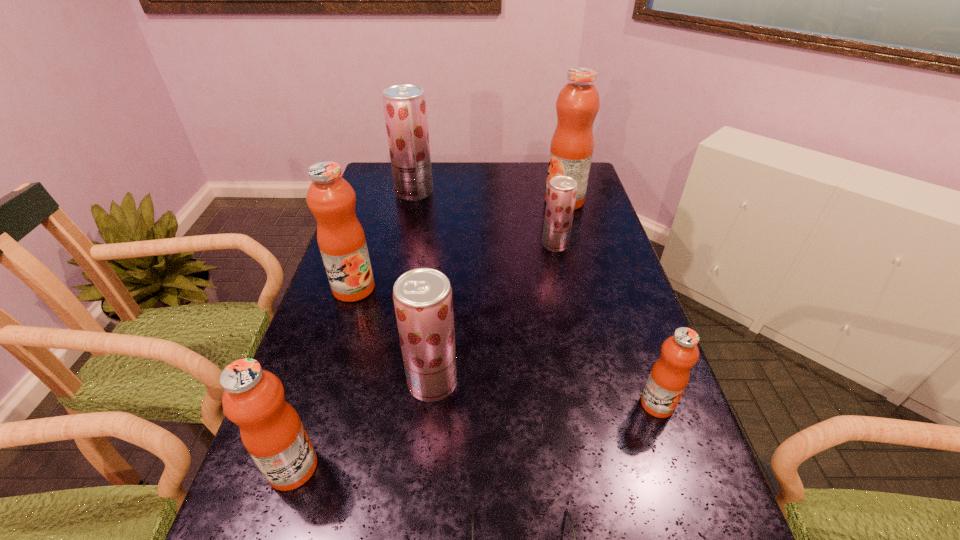
Where is `the sixth nearest object`? This screenshot has height=540, width=960. the sixth nearest object is located at coordinates (562, 190).

Find the location of a particular element. Image resolution: width=960 pixels, height=540 pixels. the fifth nearest fruit juice is located at coordinates (562, 190).

Where is `the smallest orange fruit juice`? The image size is (960, 540). the smallest orange fruit juice is located at coordinates (669, 376).

Where is `vacant region located 0.380m on the front label of the farthest orange fruit juice`? The height and width of the screenshot is (540, 960). vacant region located 0.380m on the front label of the farthest orange fruit juice is located at coordinates (441, 201).

Locate an element on the screen. This screenshot has width=960, height=540. free space located on the front label of the farthest orange fruit juice is located at coordinates click(445, 201).

Locate an element on the screen. The image size is (960, 540). vacant space located 0.380m on the front label of the farthest orange fruit juice is located at coordinates (441, 201).

What are the coordinates of `blank space located on the left of the farthest strawberry fruit juice` in the screenshot? It's located at (379, 192).

Locate an element on the screen. The image size is (960, 540). free space located 0.070m on the front label of the second farthest orange fruit juice is located at coordinates (343, 322).

Where is `free space located on the right of the second strawberry fruit juice from right to left`? Image resolution: width=960 pixels, height=540 pixels. free space located on the right of the second strawberry fruit juice from right to left is located at coordinates (606, 382).

Find the location of a particular element. This screenshot has width=960, height=540. vacant space located 0.280m on the front label of the nearest orange fruit juice is located at coordinates (461, 467).